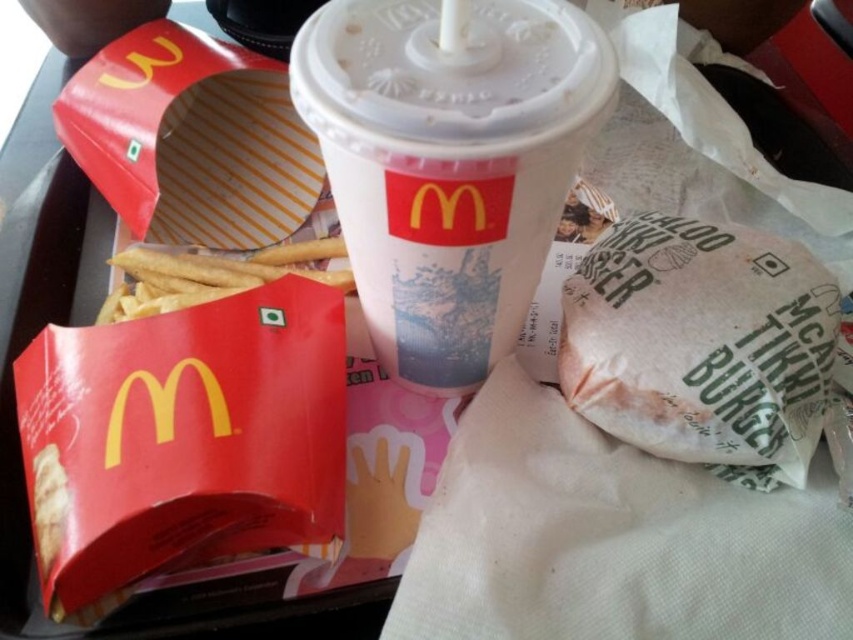
Consider the image. You are a delivery person who needs to place a McDonalds meal on a 12 inch wide shelf. The meal includes a white paper cup at center and a white paper burger at lower right. Will both items fit side by side on the shelf without overlapping?

The distance between the white paper cup at center and white paper burger at lower right is 6.49 inches. Since the shelf is 12 inches wide, there is enough space to place both items side by side without overlapping.

You are looking at the McDonalds meal on the tray. There are two points marked on the tray. One is at coordinate point (367, 70) and the other is at point (744, 365). From your perspective, which point is closer to you?

Point (367, 70) is in front of point (744, 365), so it is closer to you.

You are a customer at McDonalds and want to grab the white paper cup at center and the white paper burger at lower right. Based on their positions, which one would you reach first if you are approaching from the top of the tray?

The white paper cup at center is located above the white paper burger at lower right, so you would reach the white paper cup at center first when approaching from the top of the tray.